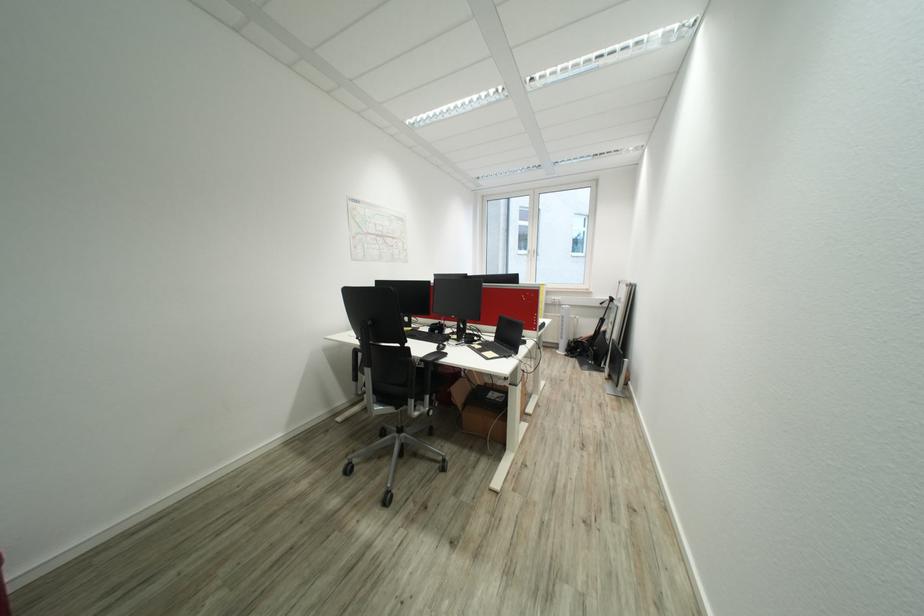
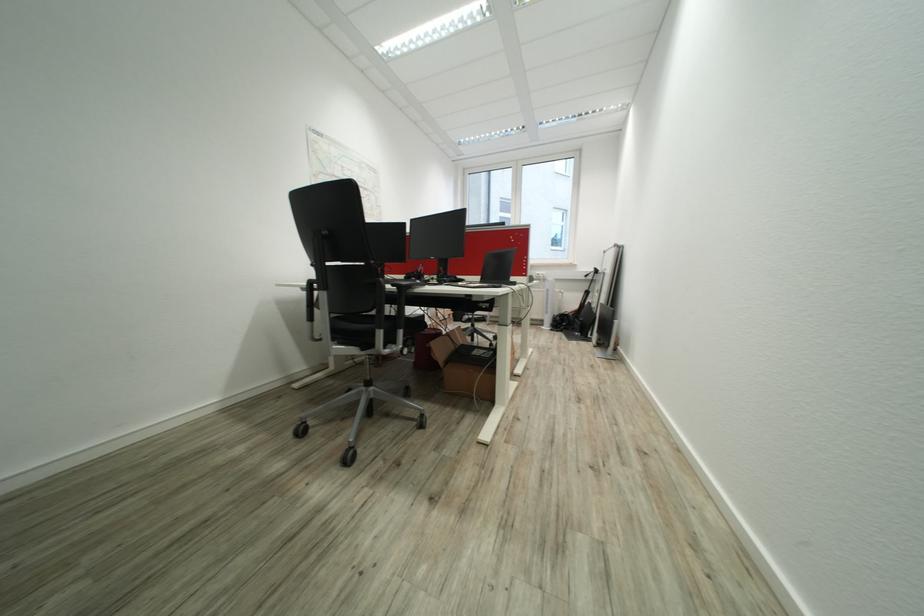
Question: The camera is either moving clockwise (left) or counter-clockwise (right) around the object. The first image is from the beginning of the video and the second image is from the end. Is the camera moving left or right when shooting the video?

Choices:
 (A) Left
 (B) Right

Answer: (A)